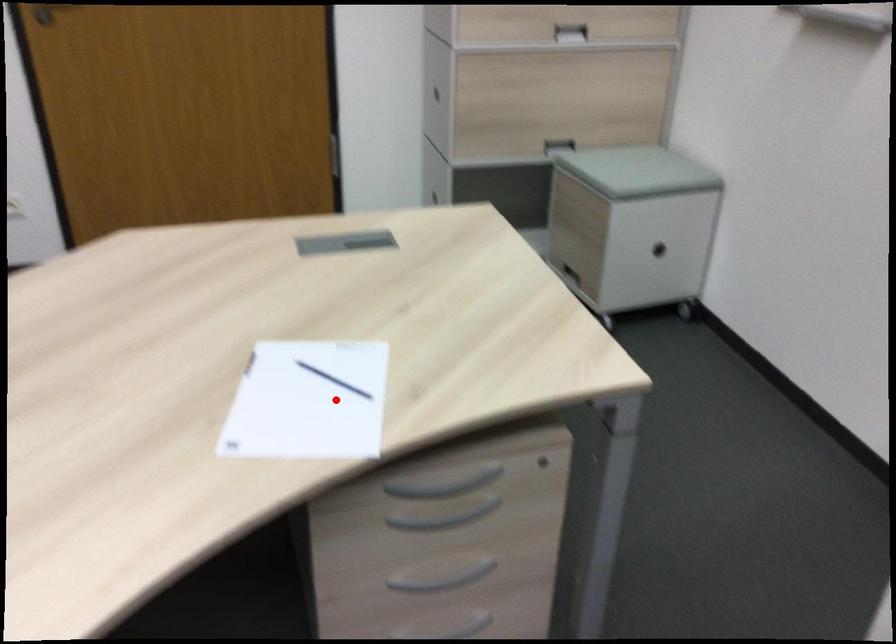
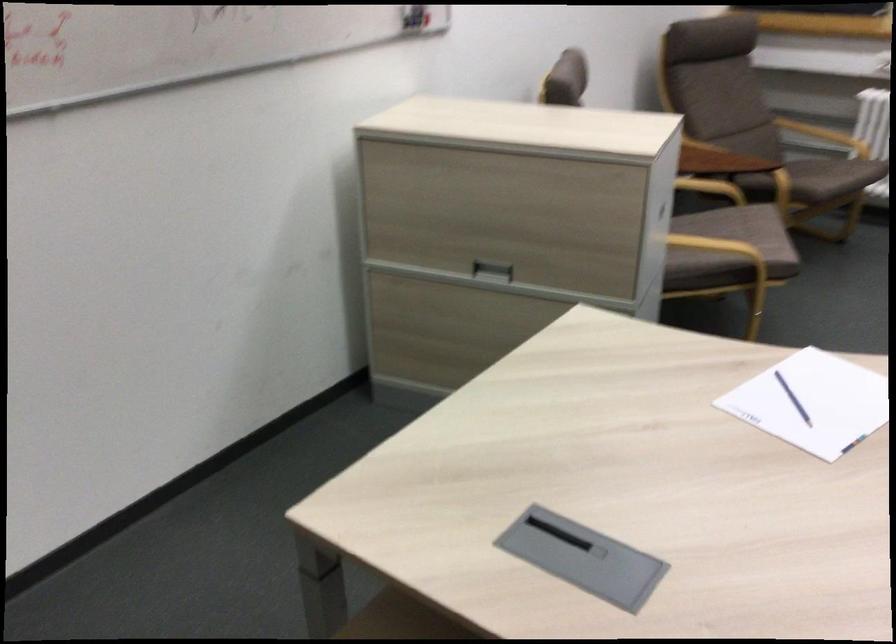
Question: I am providing you with two images of the same scene from different viewpoints. Image1 has a red point marked. In image2, the corresponding 3D location appears at what relative position? Reply with the corresponding letter.

Choices:
 (A) Closer
 (B) Farther

Answer: (B)